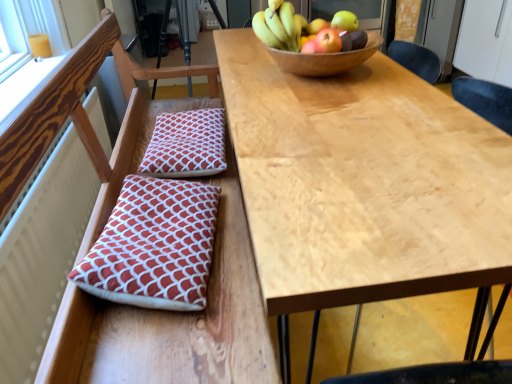
What do you see at coordinates (173, 323) in the screenshot?
I see `red-patterned cushion at left` at bounding box center [173, 323].

This screenshot has height=384, width=512. What do you see at coordinates (327, 41) in the screenshot? I see `matte red apple at upper right, arranged as the first apple when viewed from the front` at bounding box center [327, 41].

This screenshot has height=384, width=512. Identify the location of wooden bowl at upper center. (325, 59).

Find the location of a particular element. This screenshot has width=512, height=384. red-patterned cushion at left is located at coordinates (173, 323).

Are wooden bowl at upper center and matte red apple at upper right, arranged as the first apple when viewed from the front, far apart?

No, wooden bowl at upper center is in close proximity to matte red apple at upper right, arranged as the first apple when viewed from the front.

From a real-world perspective, is wooden bowl at upper center on matte red apple at upper right, arranged as the first apple when viewed from the front?

No, from a real-world perspective, wooden bowl at upper center is not above matte red apple at upper right, arranged as the first apple when viewed from the front.

Is light wood table at center positioned beyond the bounds of wooden bowl at upper center?

Result: Absolutely, light wood table at center is external to wooden bowl at upper center.

Who is shorter, light wood table at center or wooden bowl at upper center?

wooden bowl at upper center.

Considering the sizes of objects light wood table at center and wooden bowl at upper center in the image provided, who is wider, light wood table at center or wooden bowl at upper center?

light wood table at center.

Choose the correct answer: Is wooden bowl at upper center inside light wood table at center or outside it?

wooden bowl at upper center is not inside light wood table at center, it's outside.

Which is in front, point (341, 58) or point (282, 254)?

Point (282, 254)

From the image's perspective, relative to light wood table at center, is wooden bowl at upper center above or below?

Based on their image positions, wooden bowl at upper center is located above light wood table at center.

Considering the relative sizes of shiny green apple at upper center, the 1th apple positioned from the back, and matte red apple at upper right, the 3th apple when ordered from back to front, in the image provided, is shiny green apple at upper center, the 1th apple positioned from the back, wider than matte red apple at upper right, the 3th apple when ordered from back to front,?

Yes, shiny green apple at upper center, the 1th apple positioned from the back, is wider than matte red apple at upper right, the 3th apple when ordered from back to front.

There is a matte red apple at upper right, arranged as the first apple when viewed from the front. Where is `the 2nd apple above it (from the image's perspective)`? Image resolution: width=512 pixels, height=384 pixels. the 2nd apple above it (from the image's perspective) is located at coordinates (317, 26).

Is shiny green apple at upper center, the 1th apple positioned from the back, not close to matte red apple at upper right, the 3th apple when ordered from back to front?

shiny green apple at upper center, the 1th apple positioned from the back, is near matte red apple at upper right, the 3th apple when ordered from back to front, not far away.

Looking at their sizes, would you say shiny green apple at upper center, the 1th apple positioned from the back, is wider or thinner than yellow matte bananas at upper center?

Clearly, shiny green apple at upper center, the 1th apple positioned from the back, has less width compared to yellow matte bananas at upper center.

Would you say shiny green apple at upper center, the 1th apple positioned from the back, is to the left or to the right of yellow matte bananas at upper center in the picture?

shiny green apple at upper center, the 1th apple positioned from the back, is to the right of yellow matte bananas at upper center.

Considering the relative sizes of shiny green apple at upper center, which appears as the 3th apple when viewed from the front, and yellow matte bananas at upper center in the image provided, is shiny green apple at upper center, which appears as the 3th apple when viewed from the front, taller than yellow matte bananas at upper center?

Incorrect, the height of shiny green apple at upper center, which appears as the 3th apple when viewed from the front, is not larger of that of yellow matte bananas at upper center.

Where is `banana located on the left of shiny green apple at upper center, the 1th apple positioned from the back`? The height and width of the screenshot is (384, 512). banana located on the left of shiny green apple at upper center, the 1th apple positioned from the back is located at coordinates (301, 29).

The width and height of the screenshot is (512, 384). What are the coordinates of `table below the shiny yellow apple at upper right, the 2th apple in the front-to-back sequence (from a real-world perspective)` in the screenshot? It's located at (364, 184).

Considering the relative positions of light wood table at center and shiny yellow apple at upper right, the 2th apple in the front-to-back sequence, in the image provided, is light wood table at center to the left of shiny yellow apple at upper right, the 2th apple in the front-to-back sequence, from the viewer's perspective?

Yes.

Is light wood table at center positioned before shiny yellow apple at upper right, the 2th apple in the front-to-back sequence?

Yes, it is in front of shiny yellow apple at upper right, the 2th apple in the front-to-back sequence.

Is shiny yellow apple at upper right, the 2th apple in the front-to-back sequence, at the back of light wood table at center?

No.

How distant is yellow matte bananas at upper center from shiny green apple at upper center, which appears as the 3th apple when viewed from the front?

They are 2.66 inches apart.

Which of these two, yellow matte bananas at upper center or shiny green apple at upper center, which appears as the 3th apple when viewed from the front, is wider?

With larger width is yellow matte bananas at upper center.

Which of these two, yellow matte bananas at upper center or shiny green apple at upper center, which appears as the 3th apple when viewed from the front, stands taller?

With more height is yellow matte bananas at upper center.

Find the location of `banana located on the left of shiny green apple at upper center, the 1th apple positioned from the back`. banana located on the left of shiny green apple at upper center, the 1th apple positioned from the back is located at coordinates (301, 29).

Where is `bowl behind the matte red apple at upper right, the 3th apple when ordered from back to front`? bowl behind the matte red apple at upper right, the 3th apple when ordered from back to front is located at coordinates (325, 59).

Where is `table beneath the wooden bowl at upper center (from a real-world perspective)`? The image size is (512, 384). table beneath the wooden bowl at upper center (from a real-world perspective) is located at coordinates (364, 184).

Based on their spatial positions, is red printed cushion at left, the second pillow positioned from the top, or matte red apple at upper right, arranged as the first apple when viewed from the front, closer to wooden bowl at upper center?

matte red apple at upper right, arranged as the first apple when viewed from the front, lies closer to wooden bowl at upper center than the other object.

From the image, which object appears to be farther from yellow matte bananas at upper center, red cotton cushion at center, which is counted as the second pillow, starting from the bottom, or matte red apple at upper right, arranged as the first apple when viewed from the front?

red cotton cushion at center, which is counted as the second pillow, starting from the bottom, is further to yellow matte bananas at upper center.

Which object lies further to the anchor point shiny yellow apple at upper right, acting as the 2th apple starting from the back, shiny green apple at upper center, which appears as the 3th apple when viewed from the front, or yellow matte bananas at upper center?

yellow matte bananas at upper center is positioned further to the anchor shiny yellow apple at upper right, acting as the 2th apple starting from the back.

Looking at the image, which one is located further to shiny green apple at upper center, which appears as the 3th apple when viewed from the front, wooden bowl at upper center or yellow matte bananas at upper center?

wooden bowl at upper center is further to shiny green apple at upper center, which appears as the 3th apple when viewed from the front.

From the image, which object appears to be farther from red cotton cushion at center, marked as the second pillow in a front-to-back arrangement, yellow matte bananas at upper center or matte red apple at upper right, arranged as the first apple when viewed from the front?

matte red apple at upper right, arranged as the first apple when viewed from the front.

Based on their spatial positions, is yellow matte bananas at upper center or light wood table at center further from shiny yellow apple at upper right, the 2th apple in the front-to-back sequence?

Among the two, light wood table at center is located further to shiny yellow apple at upper right, the 2th apple in the front-to-back sequence.

Which object lies further to the anchor point red cotton cushion at center, positioned as the 1th pillow in back-to-front order, shiny green apple at upper center, which appears as the 3th apple when viewed from the front, or yellow matte bananas at upper center?

shiny green apple at upper center, which appears as the 3th apple when viewed from the front, is further to red cotton cushion at center, positioned as the 1th pillow in back-to-front order.

Looking at the image, which one is located further to red printed cushion at left, the first pillow ordered from the bottom, red cotton cushion at center, which is counted as the second pillow, starting from the bottom, or shiny yellow apple at upper right, the 2th apple in the front-to-back sequence?

Among the two, shiny yellow apple at upper right, the 2th apple in the front-to-back sequence, is located further to red printed cushion at left, the first pillow ordered from the bottom.

Locate an element on the screen. The height and width of the screenshot is (384, 512). bowl between shiny yellow apple at upper right, the 2th apple in the front-to-back sequence, and red printed cushion at left, the second pillow positioned from the top, vertically is located at coordinates (325, 59).

This screenshot has width=512, height=384. I want to click on bowl between light wood table at center and shiny green apple at upper center, the 1th apple positioned from the back, in the front-back direction, so click(325, 59).

Where is `bowl between red-patterned cushion at left and shiny yellow apple at upper right, acting as the 2th apple starting from the back, from front to back`? This screenshot has width=512, height=384. bowl between red-patterned cushion at left and shiny yellow apple at upper right, acting as the 2th apple starting from the back, from front to back is located at coordinates (325, 59).

Find the location of `pillow between wooden bowl at upper center and red printed cushion at left, which appears as the first pillow when viewed from the front, in the vertical direction`. pillow between wooden bowl at upper center and red printed cushion at left, which appears as the first pillow when viewed from the front, in the vertical direction is located at coordinates (186, 145).